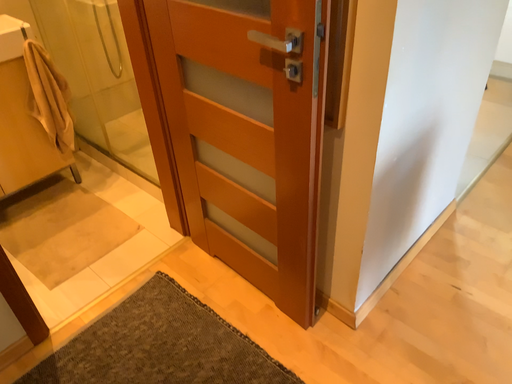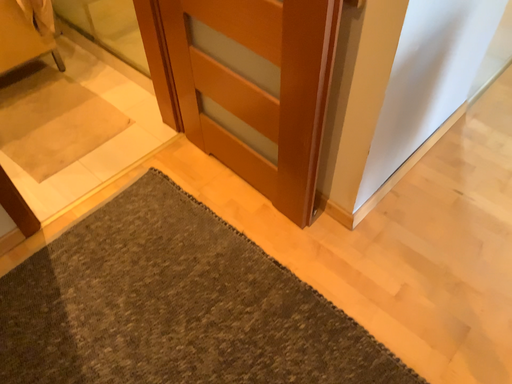
Question: Which way did the camera rotate in the video?

Choices:
 (A) rotated upward
 (B) rotated downward

Answer: (B)